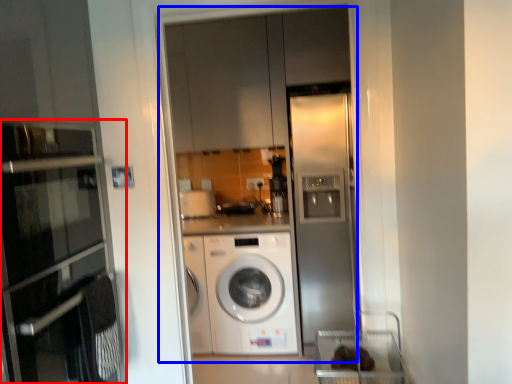
Question: Which point is further to the camera, oven (highlighted by a red box) or glass door (highlighted by a blue box)?

Choices:
 (A) oven
 (B) glass door

Answer: (B)